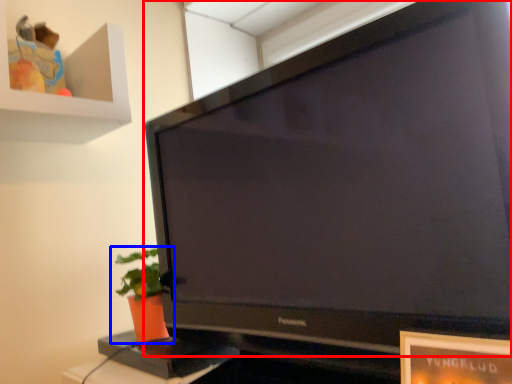
Question: Among these objects, which one is nearest to the camera, television (highlighted by a red box) or houseplant (highlighted by a blue box)?

Choices:
 (A) television
 (B) houseplant

Answer: (A)